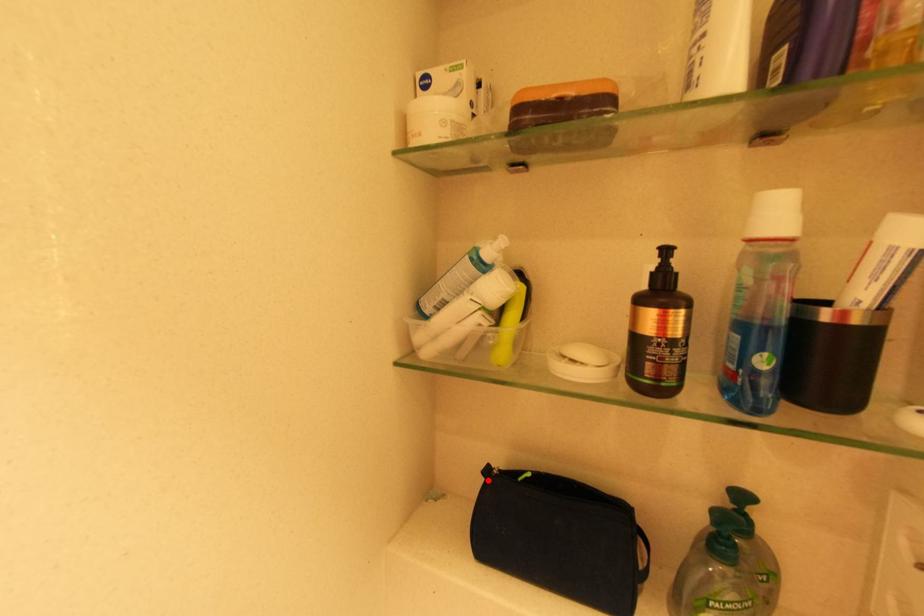
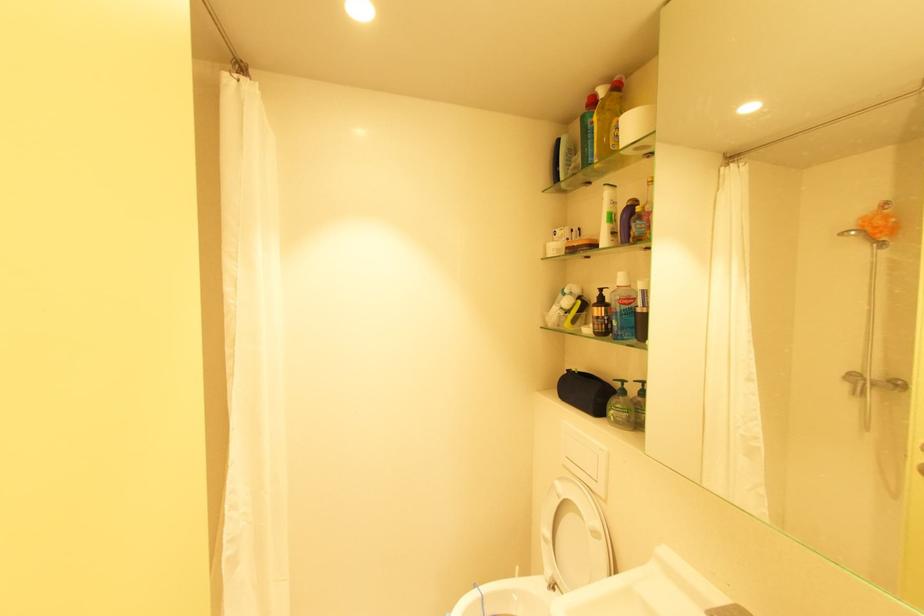
Locate, in the second image, the point that corresponds to the highlighted location in the first image.

(570, 373)